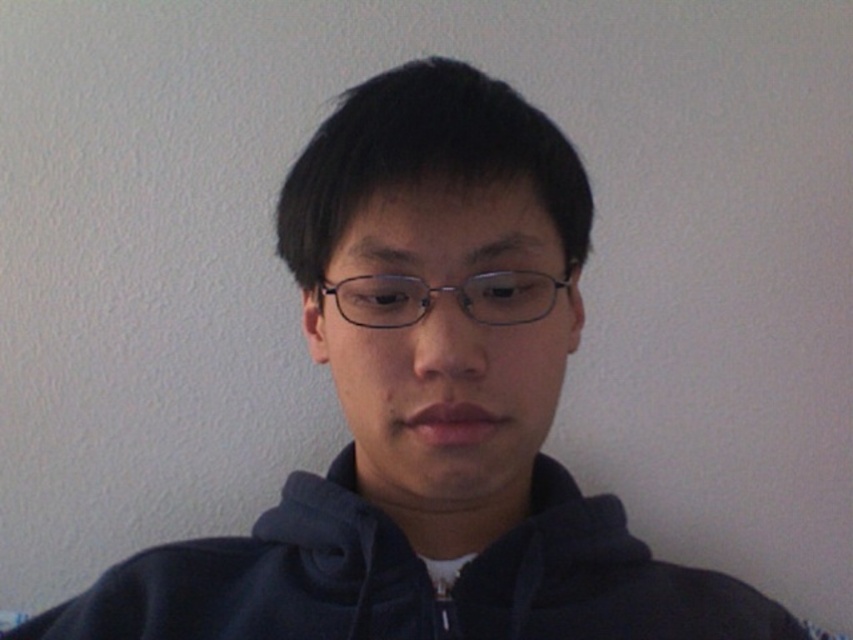
Question: Is dark blue fleece sweatshirt at center bigger than clear plastic glasses at center?

Choices:
 (A) yes
 (B) no

Answer: (A)

Question: Does dark blue fleece sweatshirt at center have a lesser width compared to clear plastic glasses at center?

Choices:
 (A) no
 (B) yes

Answer: (A)

Question: Is dark blue fleece sweatshirt at center further to the viewer compared to clear plastic glasses at center?

Choices:
 (A) no
 (B) yes

Answer: (B)

Question: Which point appears farthest from the camera in this image?

Choices:
 (A) (277, 593)
 (B) (543, 276)

Answer: (A)

Question: Which point is farther to the camera?

Choices:
 (A) dark blue fleece sweatshirt at center
 (B) clear plastic glasses at center

Answer: (A)